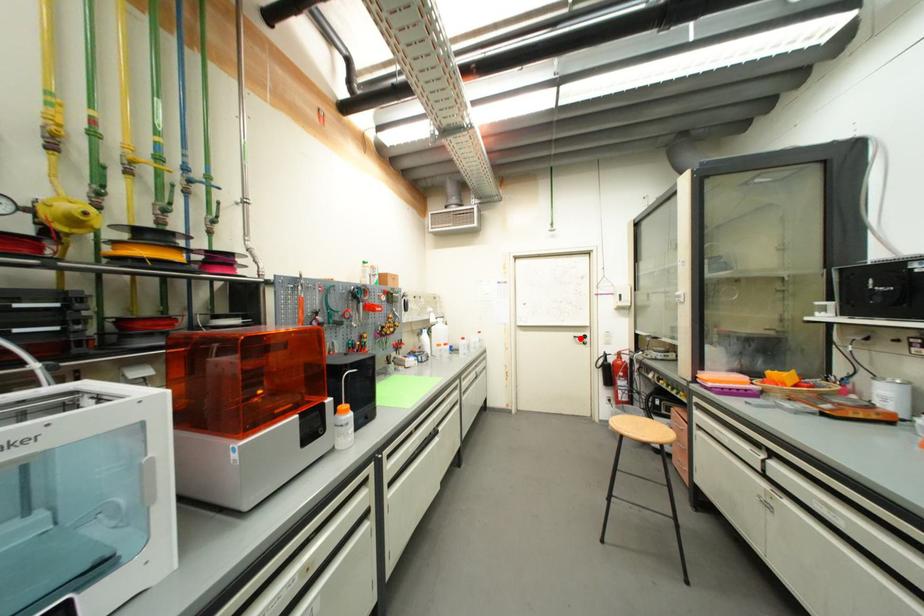
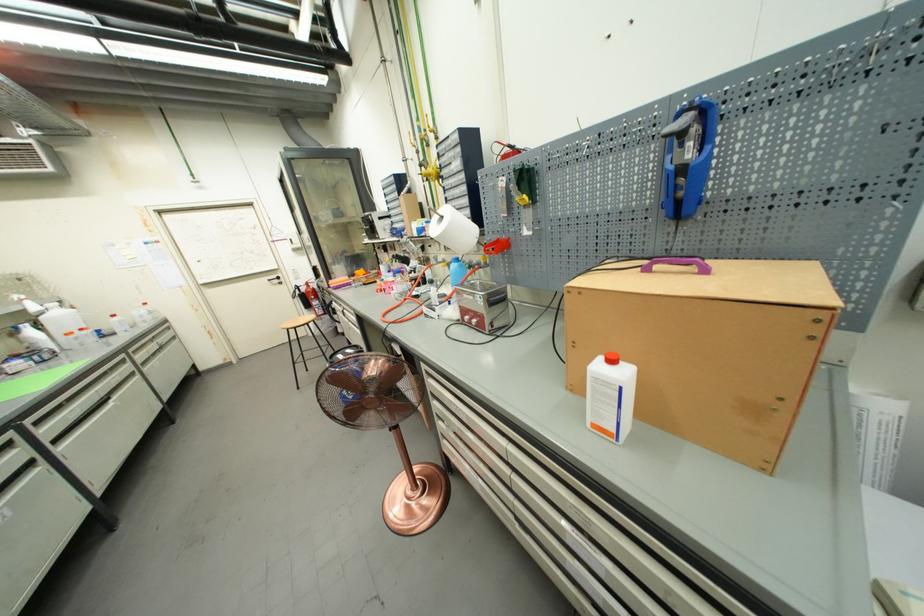
Question: I am providing you with two images of the same scene from different viewpoints. In image1, a red point is highlighted. Considering the same 3D point in image2, which of the following is correct?

Choices:
 (A) It is closer
 (B) It is farther

Answer: (A)